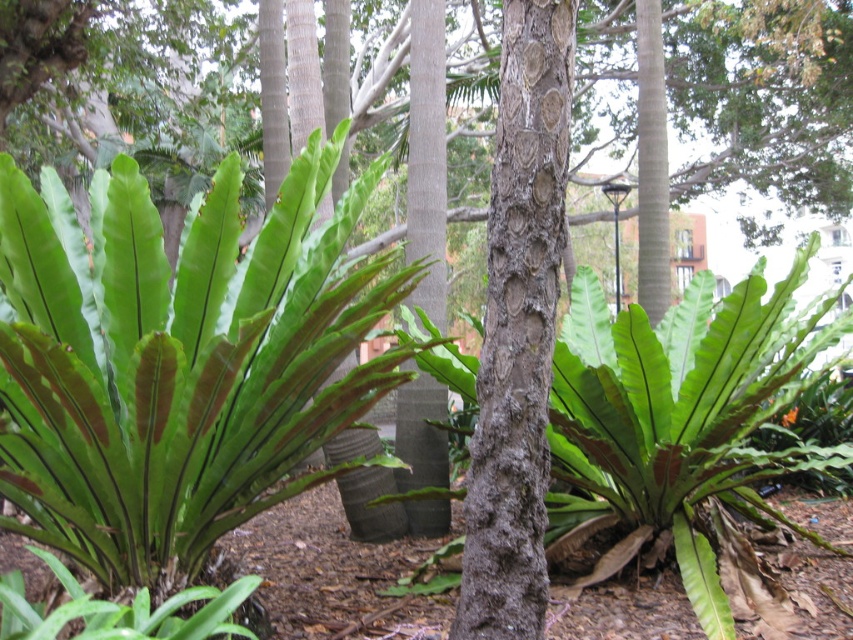
How far apart are green matte leafy fern at center and green matte fern at center?

green matte leafy fern at center is 6.73 feet from green matte fern at center.

Which is above, green matte leafy fern at center or green matte fern at center?

green matte leafy fern at center is above.

Locate an element on the screen. This screenshot has height=640, width=853. green matte leafy fern at center is located at coordinates (178, 362).